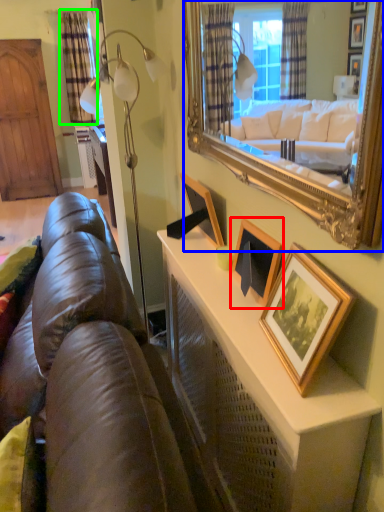
Question: Which object is the farthest from picture frame (highlighted by a red box)? Choose among these: mirror (highlighted by a blue box) or curtain (highlighted by a green box).

Choices:
 (A) mirror
 (B) curtain

Answer: (B)